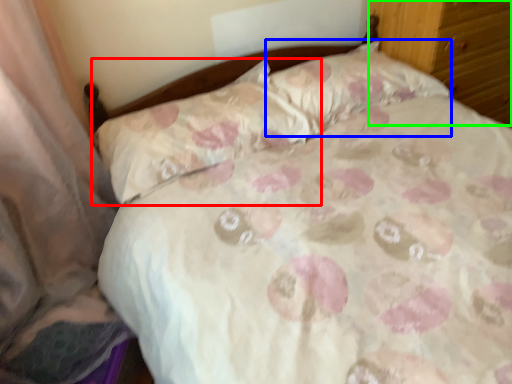
Question: Which object is the farthest from pillow (highlighted by a red box)? Choose among these: pillow (highlighted by a blue box) or dresser (highlighted by a green box).

Choices:
 (A) pillow
 (B) dresser

Answer: (B)